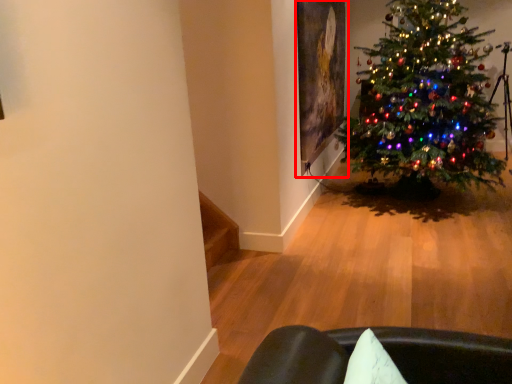
Question: From the image's perspective, what is the correct spatial positioning of picture frame (annotated by the red box) in reference to christmas tree?

Choices:
 (A) above
 (B) below

Answer: (A)